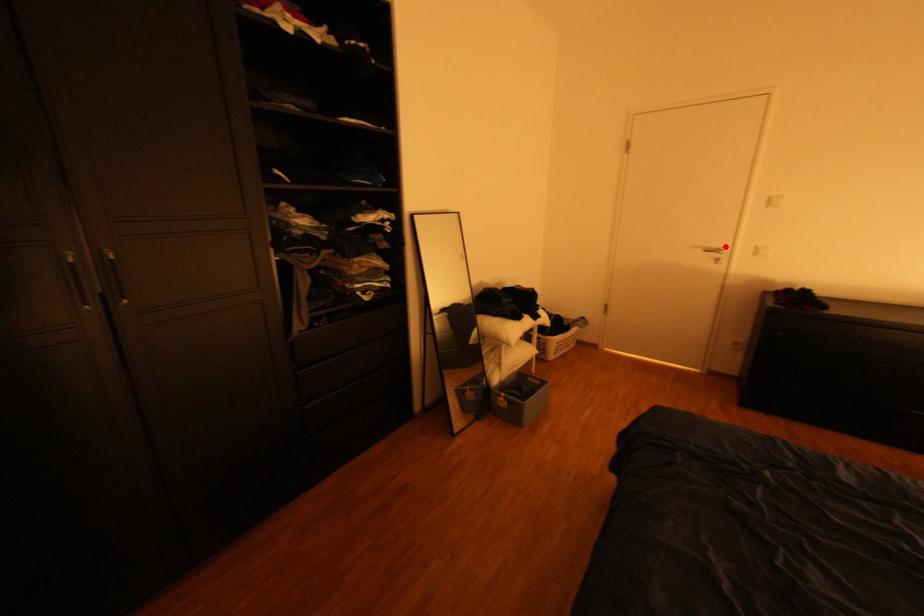
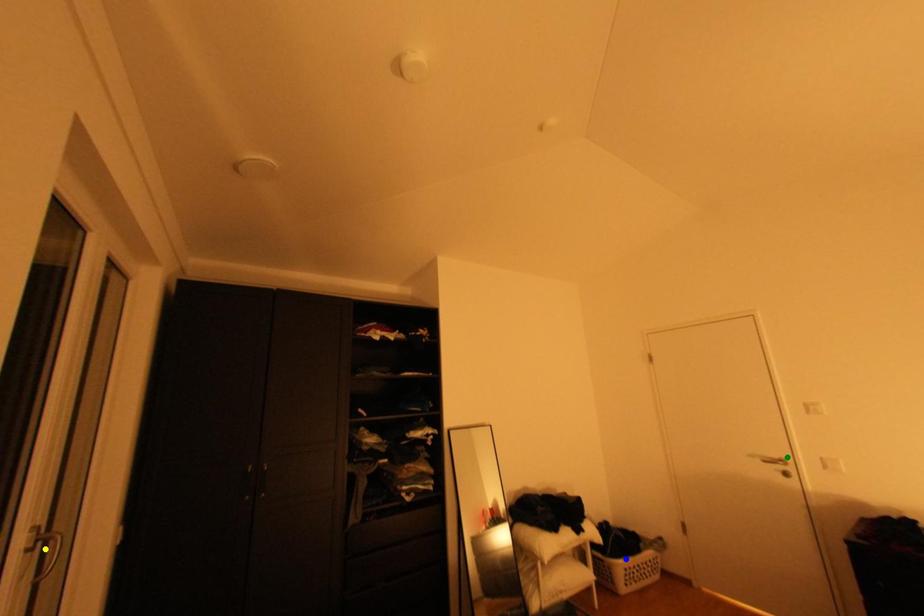
Question: I am providing you with two images of the same scene from different viewpoints. A red point is marked on the first image. You are given multiple points on the second image. Which spot in image 2 lines up with the point in image 1?

Choices:
 (A) blue point
 (B) green point
 (C) yellow point

Answer: (B)